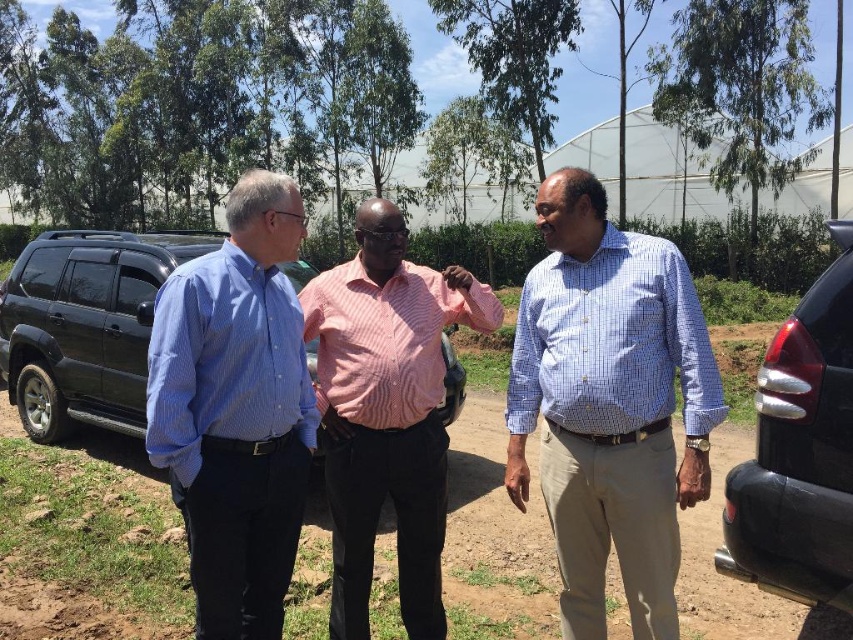
Question: Which of the following is the closest to the observer?

Choices:
 (A) (161, 324)
 (B) (102, 340)

Answer: (A)

Question: Which of the following is the farthest from the observer?

Choices:
 (A) blue striped shirt at left
 (B) blue checkered shirt at center
 (C) matte black suv at center

Answer: (C)

Question: Observing the image, what is the correct spatial positioning of blue checkered shirt at center in reference to blue striped shirt at left?

Choices:
 (A) left
 (B) right

Answer: (B)

Question: Is blue striped shirt at left thinner than pink striped shirt at center?

Choices:
 (A) no
 (B) yes

Answer: (B)

Question: Considering the relative positions of blue striped shirt at left and pink striped shirt at center in the image provided, where is blue striped shirt at left located with respect to pink striped shirt at center?

Choices:
 (A) below
 (B) above

Answer: (B)

Question: Which object is positioned farthest from the blue striped shirt at left?

Choices:
 (A) blue checkered shirt at center
 (B) glossy black car at right

Answer: (B)